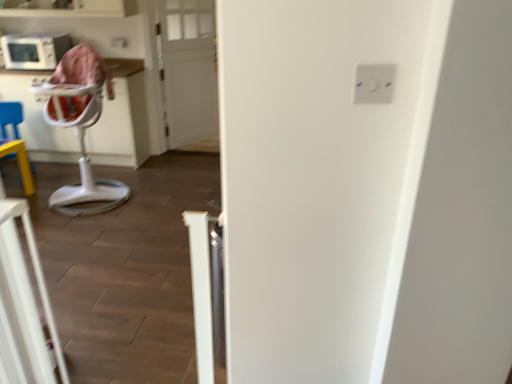
Question: Can you confirm if white wooden door at center is bigger than white plastic highchair at left?

Choices:
 (A) no
 (B) yes

Answer: (B)

Question: Is the depth of white wooden door at center greater than that of white plastic highchair at left?

Choices:
 (A) yes
 (B) no

Answer: (A)

Question: Would you consider white wooden door at center to be distant from white plastic highchair at left?

Choices:
 (A) no
 (B) yes

Answer: (B)

Question: Is white wooden door at center closer to camera compared to white plastic highchair at left?

Choices:
 (A) yes
 (B) no

Answer: (B)

Question: From the image's perspective, is white wooden door at center on top of white plastic highchair at left?

Choices:
 (A) no
 (B) yes

Answer: (B)

Question: From the image's perspective, is white plastic electric outlet at upper right above or below white plastic highchair at left?

Choices:
 (A) above
 (B) below

Answer: (A)

Question: Considering the positions of white plastic electric outlet at upper right and white plastic highchair at left in the image, is white plastic electric outlet at upper right taller or shorter than white plastic highchair at left?

Choices:
 (A) tall
 (B) short

Answer: (B)

Question: In the image, is white plastic electric outlet at upper right positioned in front of or behind white plastic highchair at left?

Choices:
 (A) front
 (B) behind

Answer: (A)

Question: Is point coord(371,89) positioned closer to the camera than point coord(0,254)?

Choices:
 (A) closer
 (B) farther

Answer: (A)

Question: Would you say white plastic electric outlet at upper right is to the left or to the right of white plastic feeding chair at left in the picture?

Choices:
 (A) left
 (B) right

Answer: (B)

Question: Is white plastic electric outlet at upper right inside or outside of white plastic feeding chair at left?

Choices:
 (A) inside
 (B) outside

Answer: (B)

Question: In terms of height, does white plastic electric outlet at upper right look taller or shorter compared to white plastic feeding chair at left?

Choices:
 (A) short
 (B) tall

Answer: (A)

Question: Is point click(384, 66) closer or farther from the camera than point click(92, 89)?

Choices:
 (A) closer
 (B) farther

Answer: (A)

Question: In terms of height, does white wooden door at center look taller or shorter compared to white plastic electric outlet at upper right?

Choices:
 (A) tall
 (B) short

Answer: (A)

Question: Is point (181, 6) positioned closer to the camera than point (365, 94)?

Choices:
 (A) farther
 (B) closer

Answer: (A)